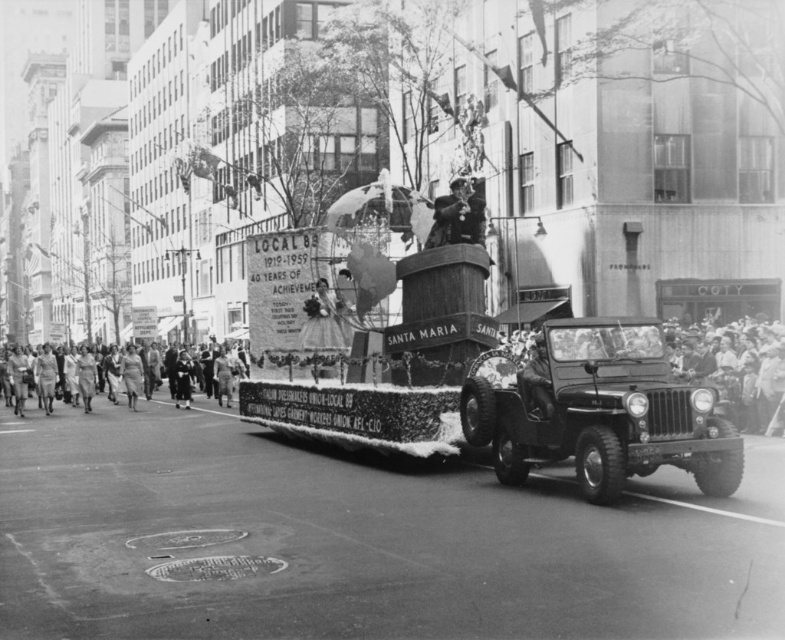
Is smooth leather hat at center in front of smooth beige dress at center?

Yes, smooth leather hat at center is closer to the viewer.

Consider the image. Is smooth leather hat at center smaller than smooth beige dress at center?

Actually, smooth leather hat at center might be larger than smooth beige dress at center.

Based on the photo, who is more forward, [761,346] or [137,369]?

Positioned in front is point [761,346].

Where is `smooth leather hat at center`? The height and width of the screenshot is (640, 785). smooth leather hat at center is located at coordinates (736, 365).

Between smooth black suit at center and smooth beige dress at center, which one is positioned lower?

smooth beige dress at center

Measure the distance between smooth black suit at center and camera.

They are 50.48 feet apart.

Image resolution: width=785 pixels, height=640 pixels. In order to click on smooth black suit at center in this screenshot , I will do `click(457, 216)`.

Can you confirm if metallic matte jeep at center is smaller than smooth black suit at center?

Incorrect, metallic matte jeep at center is not smaller in size than smooth black suit at center.

What do you see at coordinates (601, 412) in the screenshot? I see `metallic matte jeep at center` at bounding box center [601, 412].

Does point (677, 417) come in front of point (429, 243)?

Yes, it is in front of point (429, 243).

You are a GUI agent. You are given a task and a screenshot of the screen. Output one action in this format:
    pyautogui.click(x=<x>, y=<y>)
    Task: Click on the metallic matte jeep at center
    The height and width of the screenshot is (640, 785).
    Given the screenshot: What is the action you would take?
    click(x=601, y=412)